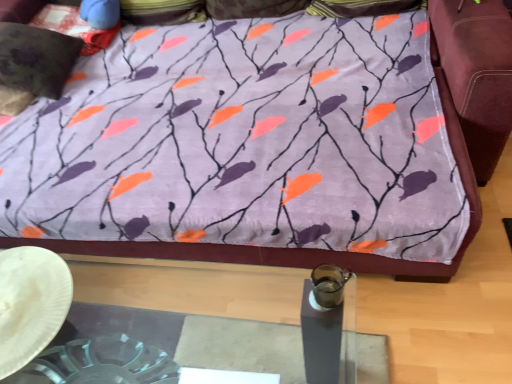
Question: Is point (31, 311) positioned closer to the camera than point (394, 274)?

Choices:
 (A) closer
 (B) farther

Answer: (A)

Question: Considering their positions, is white paper plate at lower left located in front of or behind purple fabric bedspread at upper center?

Choices:
 (A) behind
 (B) front

Answer: (B)

Question: Estimate the real-world distances between objects in this image. Which object is closer to the purple fabric pillow at upper center, which appears as the 3th pillow when ordered from the bottom?

Choices:
 (A) velvety black pillow at upper left, the first pillow positioned from the bottom
 (B) purple fabric bedspread at upper center
 (C) white paper plate at lower left
 (D) velvety dark brown pillow at upper left, marked as the 2th pillow in a bottom-to-top arrangement

Answer: (D)

Question: Which of these objects is positioned farthest from the purple fabric bedspread at upper center?

Choices:
 (A) velvety black pillow at upper left, which is counted as the 3th pillow, starting from the top
 (B) velvety dark brown pillow at upper left, marked as the 2th pillow in a bottom-to-top arrangement
 (C) purple fabric pillow at upper center, the first pillow when ordered from top to bottom
 (D) white paper plate at lower left

Answer: (B)